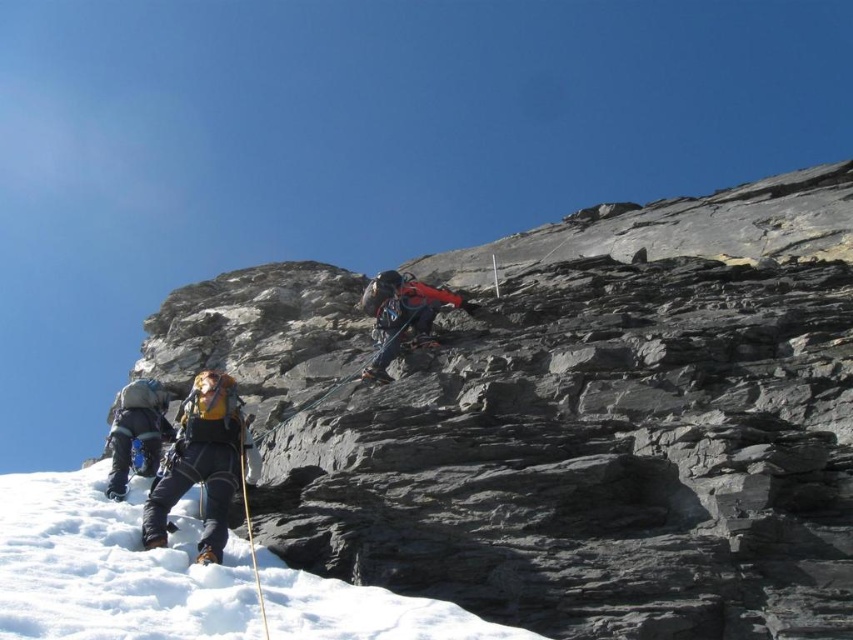
Is white powdery snow at lower left smaller than orange fabric harness at center?

Yes, white powdery snow at lower left is smaller than orange fabric harness at center.

Which is above, white powdery snow at lower left or orange fabric harness at center?

orange fabric harness at center is higher up.

Where is `white powdery snow at lower left`? Image resolution: width=853 pixels, height=640 pixels. white powdery snow at lower left is located at coordinates (109, 568).

Who is more distant from viewer, (465, 308) or (113, 444)?

Positioned behind is point (465, 308).

Is orange fabric harness at center wider than matte blue jacket at lower left?

No.

Which is behind, point (415, 321) or point (120, 420)?

Point (415, 321)

Locate an element on the screen. The width and height of the screenshot is (853, 640). orange fabric harness at center is located at coordinates (x=402, y=316).

Does gray rock wall at upper center appear on the left side of matte blue jacket at lower left?

In fact, gray rock wall at upper center is to the right of matte blue jacket at lower left.

Based on the photo, is gray rock wall at upper center taller than matte blue jacket at lower left?

Yes, gray rock wall at upper center is taller than matte blue jacket at lower left.

Locate an element on the screen. This screenshot has height=640, width=853. gray rock wall at upper center is located at coordinates (608, 428).

Find the location of `gray rock wall at upper center`. gray rock wall at upper center is located at coordinates (608, 428).